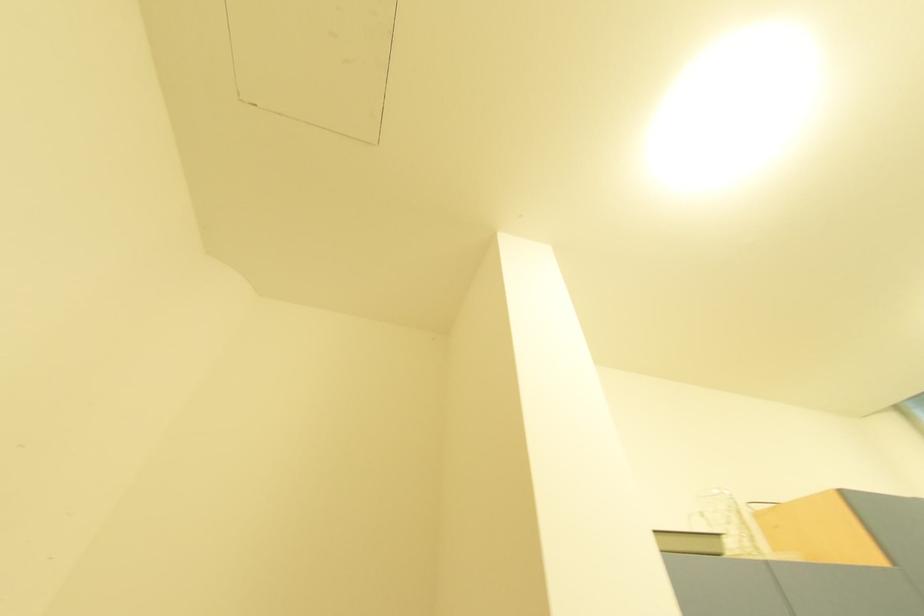
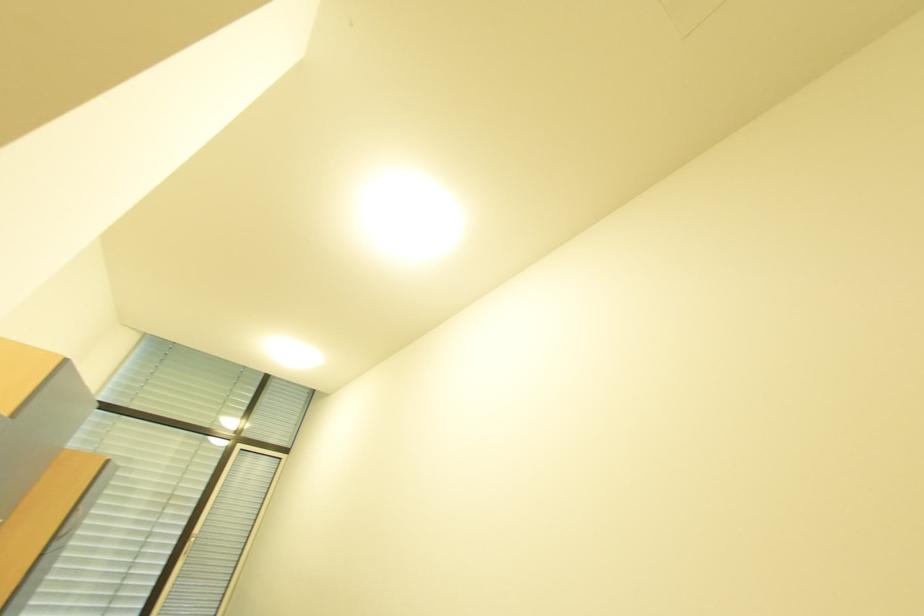
The images are taken continuously from a first-person perspective. In which direction is your viewpoint rotating?

The camera rotated toward right-up.